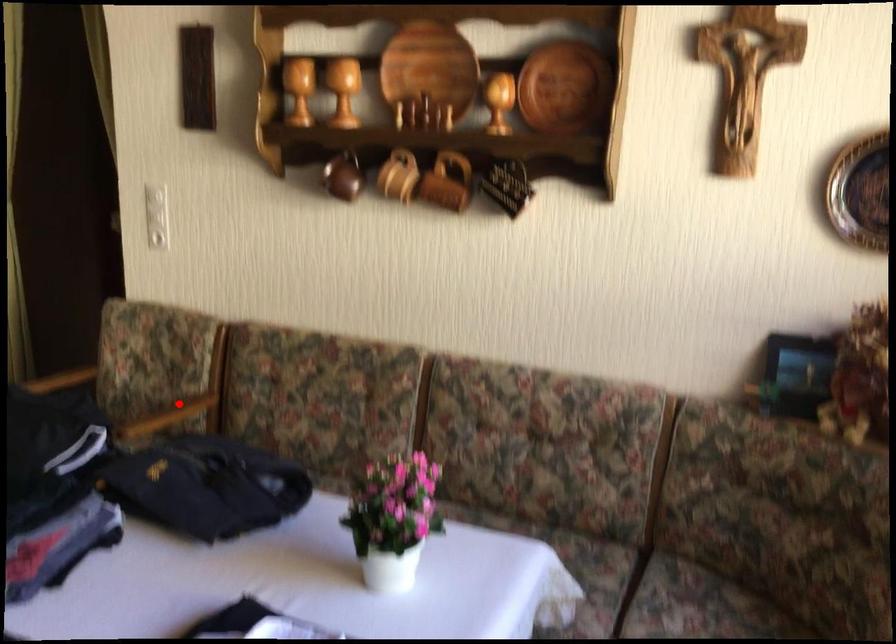
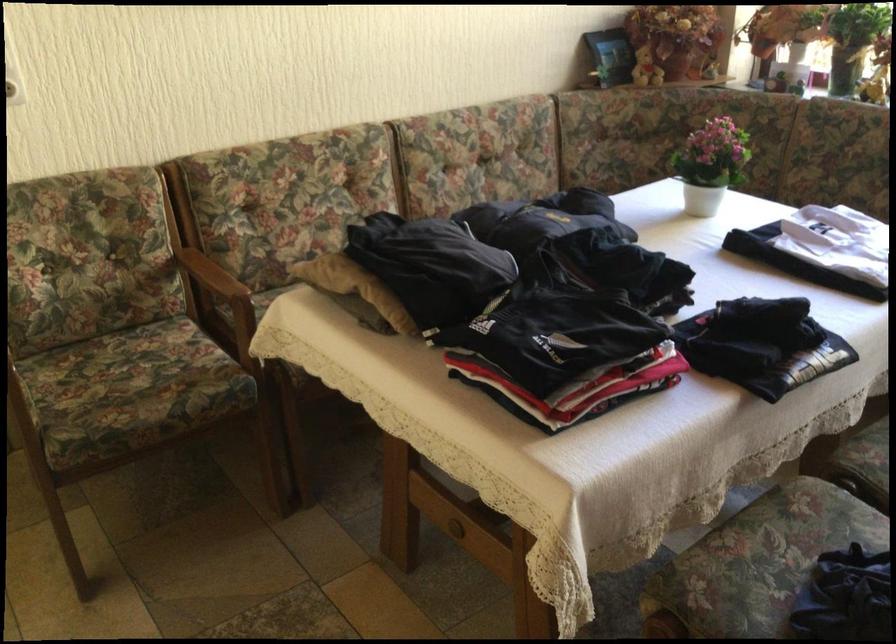
Where in the second image is the point corresponding to the highlighted location from the first image?

(204, 269)